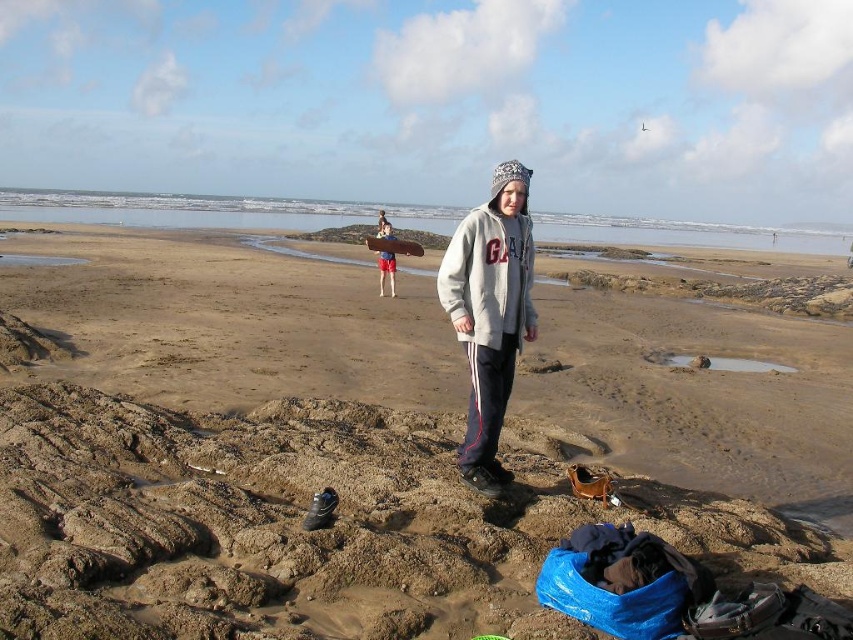
You are standing on the beach and see the brown sand at center and the gray fleece sweatshirt at center. Which object is positioned to the left of the other?

The brown sand at center is to the left of the gray fleece sweatshirt at center.

You are trying to decide which item to take with you from the beach. The gray fleece jacket at center and the gray fleece sweatshirt at center are both available. If you need something that covers more of your arms, which one should you choose?

→ The gray fleece jacket at center is wider than the gray fleece sweatshirt at center, so it would cover more of your arms.

You are standing on the beach and see the brown sand at center and the gray fleece sweatshirt at center. Which object is higher in elevation?

The brown sand at center is much taller than the gray fleece sweatshirt at center, so the brown sand at center is higher in elevation.